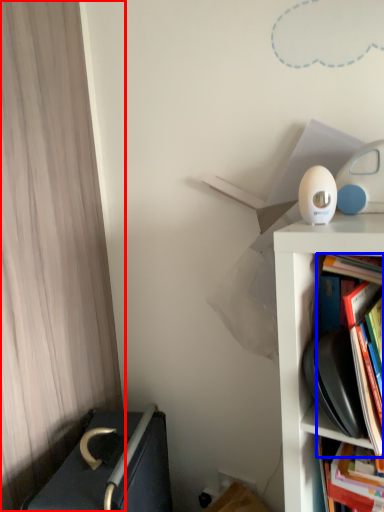
Question: Which object is closer to the camera taking this photo, curtain (highlighted by a red box) or book (highlighted by a blue box)?

Choices:
 (A) curtain
 (B) book

Answer: (B)